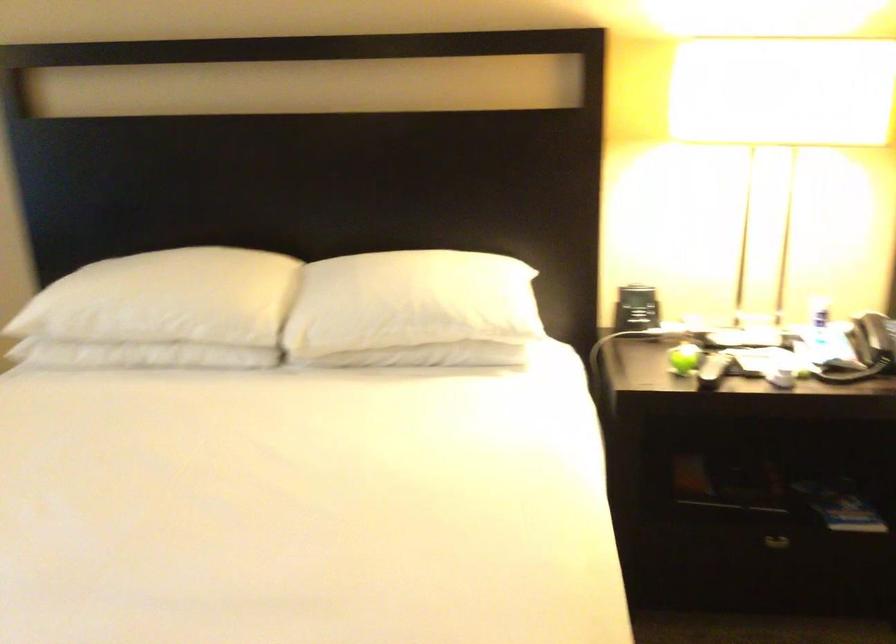
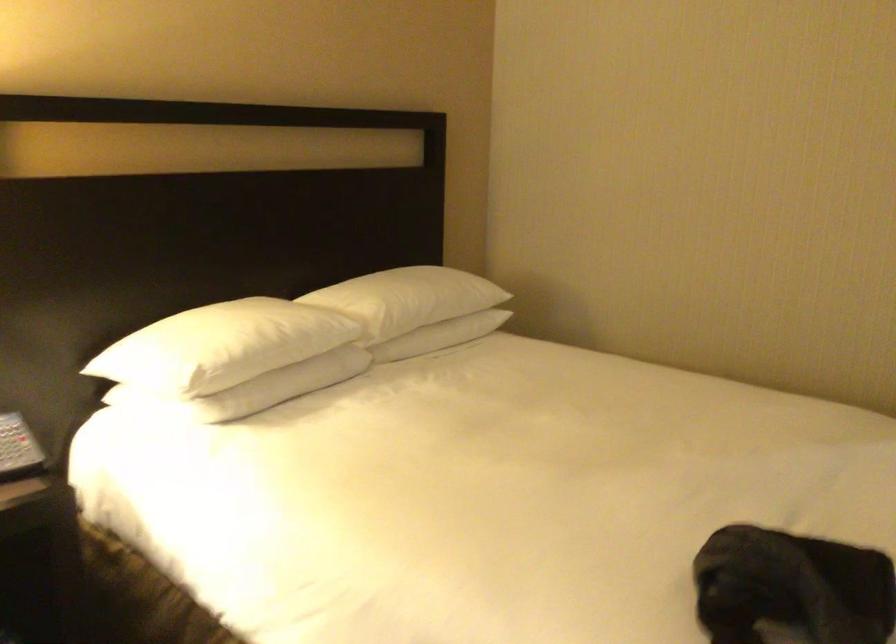
Question: Based on the continuous images, in which direction is the camera rotating? Reply with the corresponding letter.

Choices:
 (A) Left
 (B) Right
 (C) Up
 (D) Down

Answer: (B)